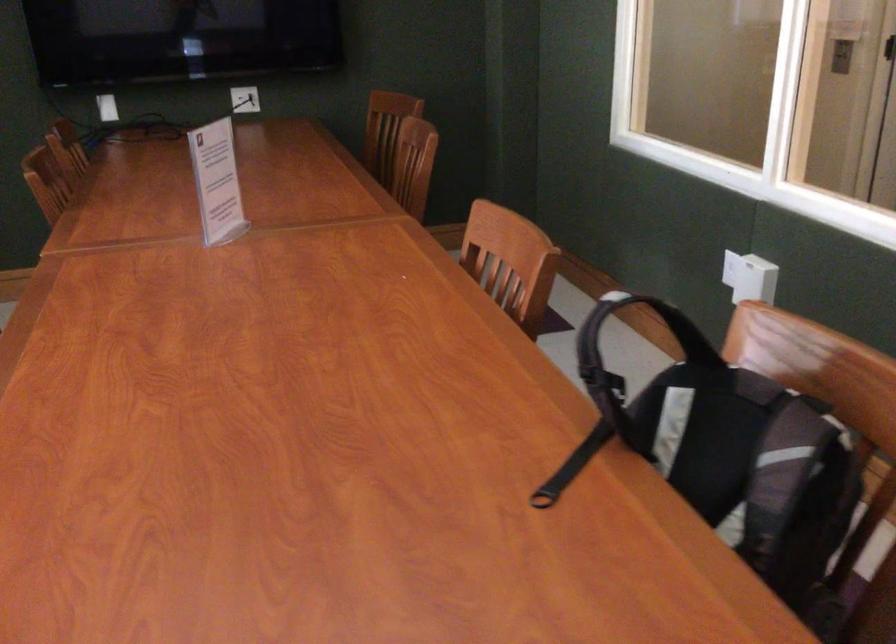
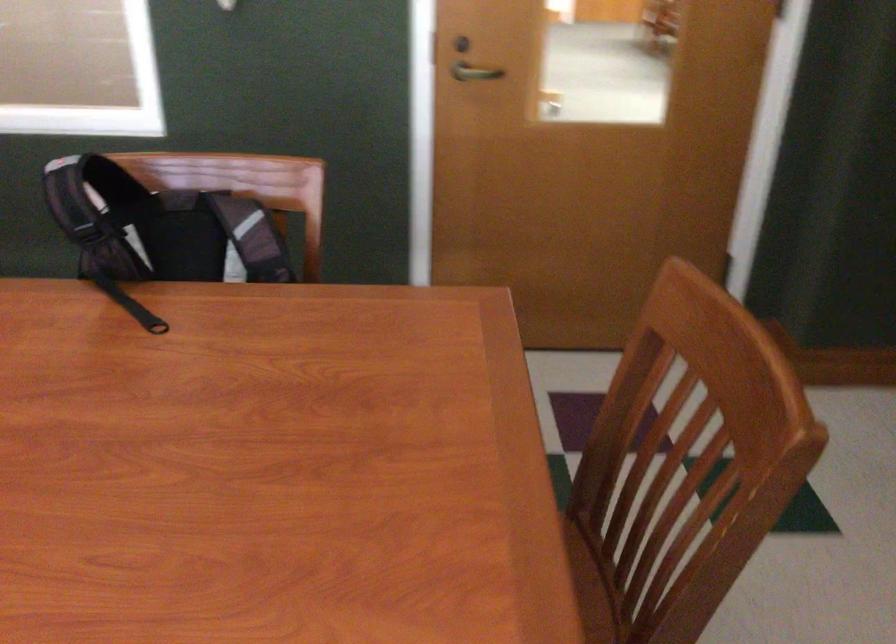
The point at (716, 402) is marked in the first image. Where is the corresponding point in the second image?

(159, 228)